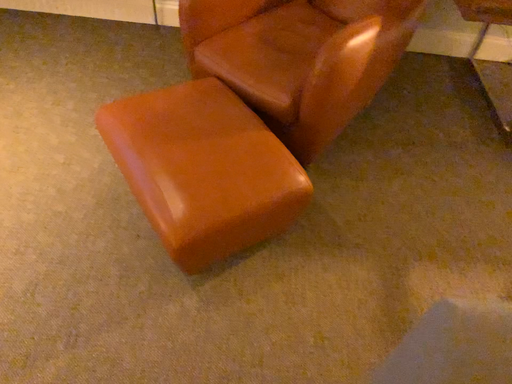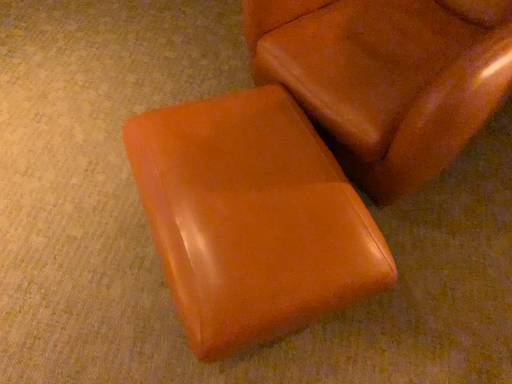
Question: Which way did the camera rotate in the video?

Choices:
 (A) rotated right
 (B) rotated left

Answer: (B)